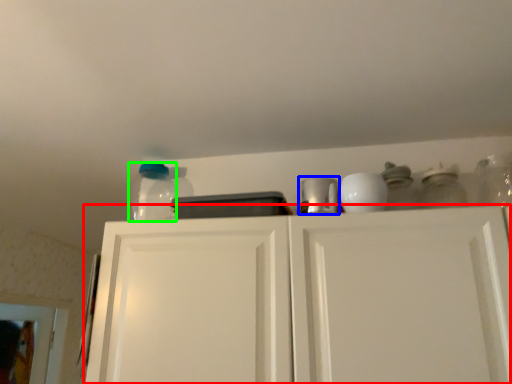
Question: Estimate the real-world distances between objects in this image. Which object is farther from cabinetry (highlighted by a red box), appliance (highlighted by a blue box) or glass jar (highlighted by a green box)?

Choices:
 (A) appliance
 (B) glass jar

Answer: (B)